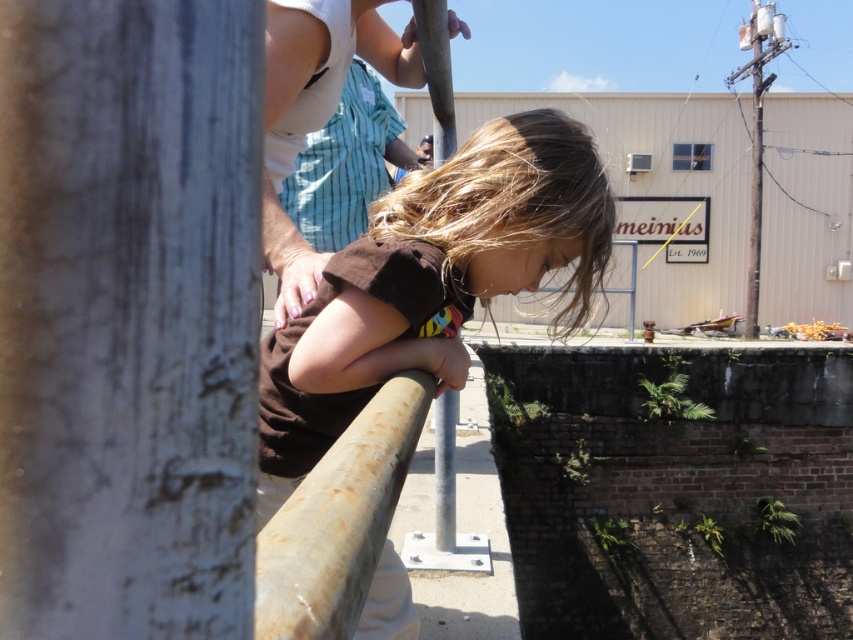
Question: Can you confirm if brown matte shirt at center is positioned above brown matte hair at center?

Choices:
 (A) no
 (B) yes

Answer: (A)

Question: In this image, where is brown matte shirt at center located relative to brown matte hair at center?

Choices:
 (A) left
 (B) right

Answer: (A)

Question: Is brown matte shirt at center behind brown matte hair at center?

Choices:
 (A) yes
 (B) no

Answer: (B)

Question: Which point appears closest to the camera in this image?

Choices:
 (A) (531, 236)
 (B) (274, 454)

Answer: (A)